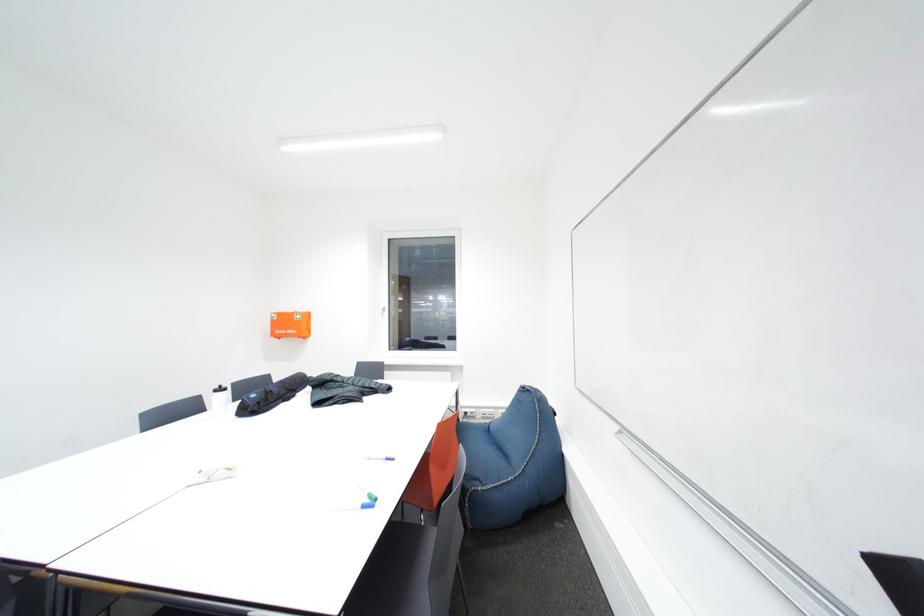
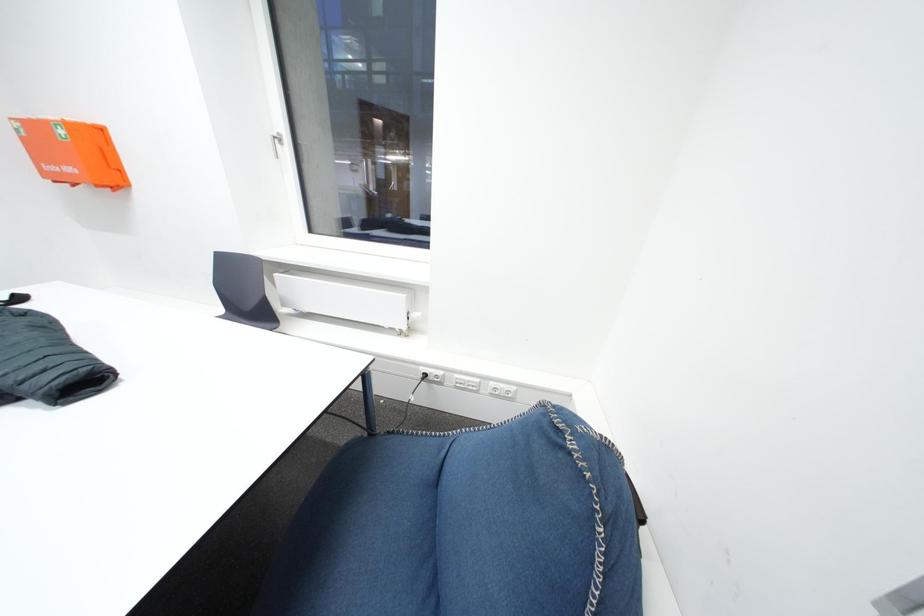
Question: Which direction would the cameraman need to move to produce the second image? Reply with the corresponding letter.

Choices:
 (A) Left
 (B) Right
 (C) Forward
 (D) Backward

Answer: (C)